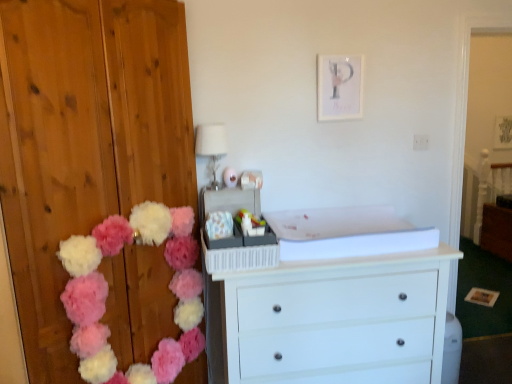
Question: Is white painted wood chest of drawers at center in contact with brown wood cabinet at right?

Choices:
 (A) no
 (B) yes

Answer: (A)

Question: From the image's perspective, is white painted wood chest of drawers at center above brown wood cabinet at right?

Choices:
 (A) no
 (B) yes

Answer: (A)

Question: Can you confirm if white painted wood chest of drawers at center is wider than brown wood cabinet at right?

Choices:
 (A) yes
 (B) no

Answer: (A)

Question: Considering the relative positions of white painted wood chest of drawers at center and brown wood cabinet at right in the image provided, is white painted wood chest of drawers at center to the right of brown wood cabinet at right from the viewer's perspective?

Choices:
 (A) no
 (B) yes

Answer: (A)

Question: Can brown wood cabinet at right be found inside white painted wood chest of drawers at center?

Choices:
 (A) no
 (B) yes

Answer: (A)

Question: Is point (498, 226) closer or farther from the camera than point (129, 231)?

Choices:
 (A) closer
 (B) farther

Answer: (B)

Question: Is brown wood cabinet at right to the left or to the right of fluffy fabric pom-poms at left in the image?

Choices:
 (A) right
 (B) left

Answer: (A)

Question: Looking at their shapes, would you say brown wood cabinet at right is wider or thinner than fluffy fabric pom-poms at left?

Choices:
 (A) thin
 (B) wide

Answer: (B)

Question: Considering the positions of brown wood cabinet at right and fluffy fabric pom-poms at left in the image, is brown wood cabinet at right bigger or smaller than fluffy fabric pom-poms at left?

Choices:
 (A) big
 (B) small

Answer: (A)

Question: Is point (317, 299) closer or farther from the camera than point (139, 231)?

Choices:
 (A) farther
 (B) closer

Answer: (B)

Question: Considering their positions, is white painted wood chest of drawers at center located in front of or behind fluffy fabric pom-poms at left?

Choices:
 (A) front
 (B) behind

Answer: (B)

Question: Would you say white painted wood chest of drawers at center is inside or outside fluffy fabric pom-poms at left?

Choices:
 (A) outside
 (B) inside

Answer: (A)

Question: Considering the positions of white painted wood chest of drawers at center and fluffy fabric pom-poms at left in the image, is white painted wood chest of drawers at center wider or thinner than fluffy fabric pom-poms at left?

Choices:
 (A) wide
 (B) thin

Answer: (A)

Question: From the image's perspective, relative to brown wood cabinet at right, is white glass lampshade at upper center above or below?

Choices:
 (A) below
 (B) above

Answer: (B)

Question: From a real-world perspective, is white glass lampshade at upper center physically located above or below brown wood cabinet at right?

Choices:
 (A) below
 (B) above

Answer: (B)